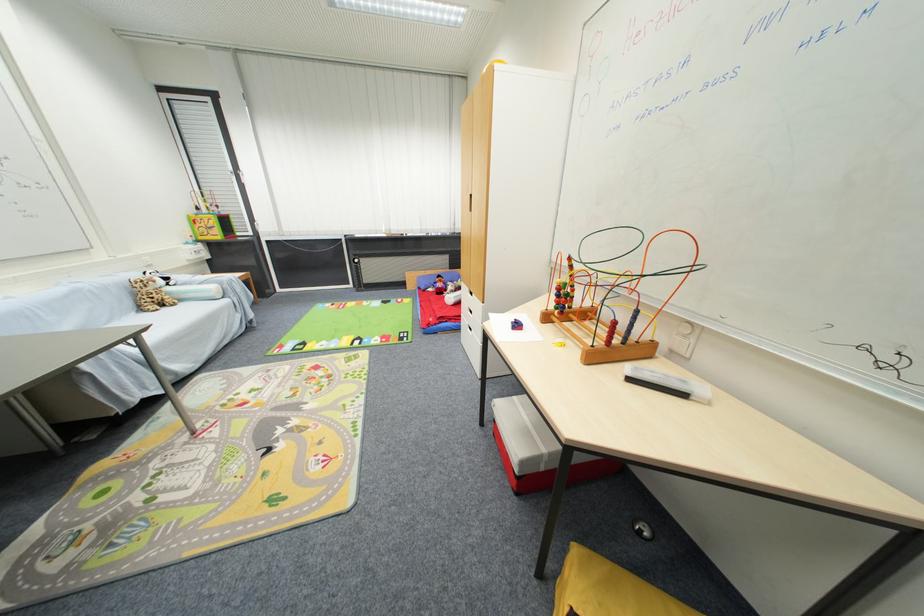
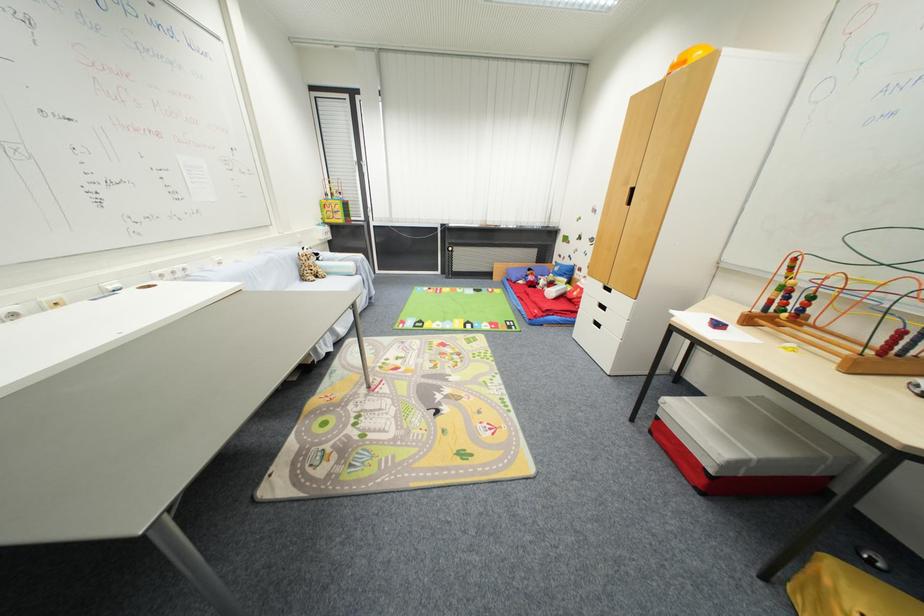
The point at (244, 317) is marked in the first image. Where is the corresponding point in the second image?

(371, 293)